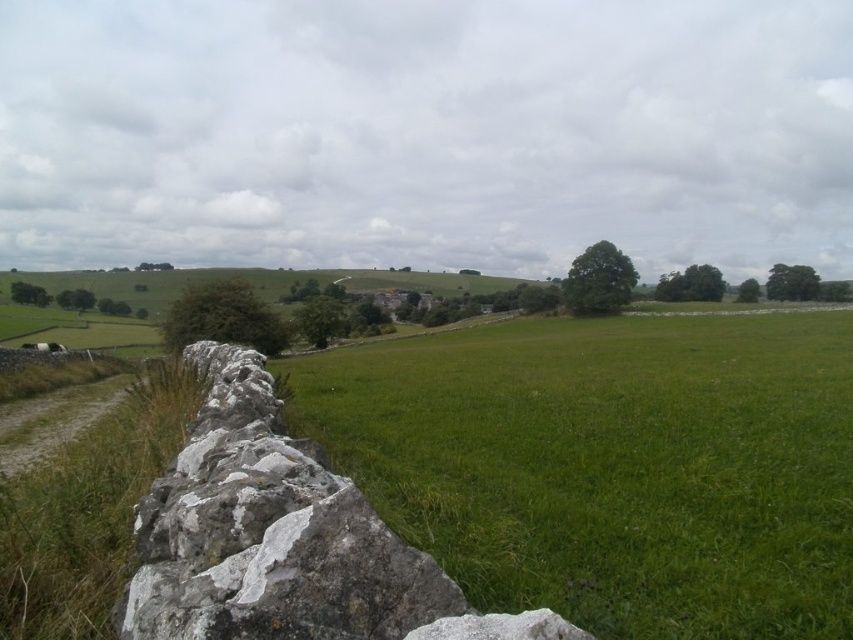
In the scene shown: You are standing in the middle of the green grassy field at center and want to walk towards the white rough stone at left. Which direction should you head?

Since the green grassy field at center is closer to you than the white rough stone at left, you should head towards the left to reach the white rough stone at left.